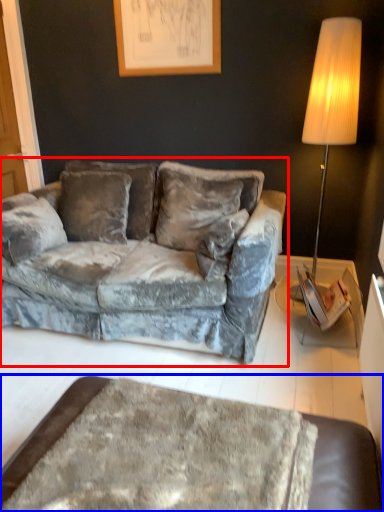
Question: Which object appears farthest to the camera in this image, studio couch (highlighted by a red box) or table (highlighted by a blue box)?

Choices:
 (A) studio couch
 (B) table

Answer: (A)